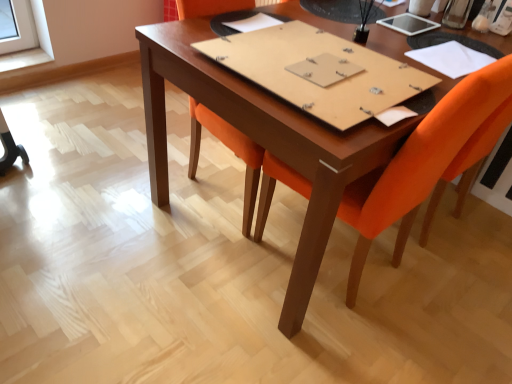
Question: Is brown cardboard notebook at center, acting as the second notebook starting from the left, situated inside orange fabric chair at center or outside?

Choices:
 (A) inside
 (B) outside

Answer: (A)

Question: Considering the relative positions of brown cardboard notebook at center, acting as the second notebook starting from the left, and orange fabric chair at center in the image provided, is brown cardboard notebook at center, acting as the second notebook starting from the left, to the left or to the right of orange fabric chair at center?

Choices:
 (A) left
 (B) right

Answer: (A)

Question: Which of these objects is positioned farthest from the orange fabric chair at center?

Choices:
 (A) white paper at upper right, the third notebook when ordered from left to right
 (B) white paper at center, which is the 1th notebook from left to right
 (C) brown cardboard notebook at center, acting as the second notebook starting from the left

Answer: (B)

Question: Which object is the farthest from the orange fabric chair at center?

Choices:
 (A) white paper at upper right, the third notebook when ordered from left to right
 (B) white paper at center, which is the 1th notebook from left to right
 (C) brown cardboard notebook at center, acting as the second notebook starting from the left

Answer: (B)